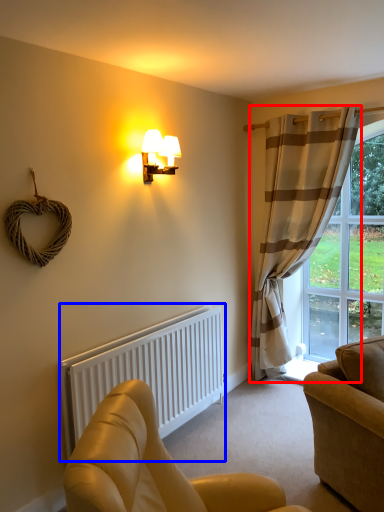
Question: Among these objects, which one is farthest to the camera, curtain (highlighted by a red box) or radiator (highlighted by a blue box)?

Choices:
 (A) curtain
 (B) radiator

Answer: (A)